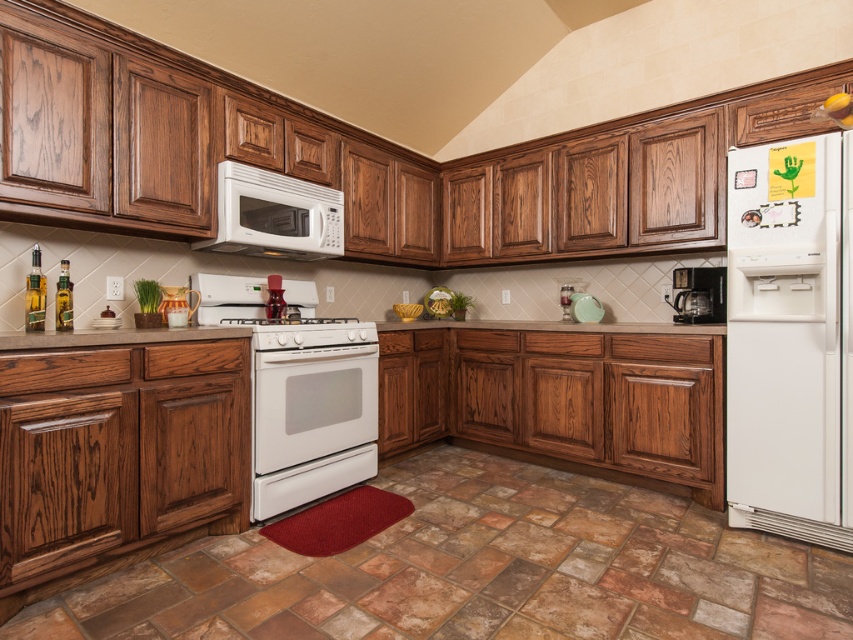
Does white glossy refrigerator at right have a greater height compared to brown wood countertop at center?

Yes, white glossy refrigerator at right is taller than brown wood countertop at center.

Does point (830, 412) come closer to viewer compared to point (45, 342)?

No.

Which is in front, point (828, 278) or point (56, 332)?

Point (56, 332)

Locate an element on the screen. This screenshot has width=853, height=640. white glossy refrigerator at right is located at coordinates (788, 342).

Can you confirm if black plastic coffee maker at right is thinner than white glossy stove at center?

Yes, black plastic coffee maker at right is thinner than white glossy stove at center.

Which of these two, black plastic coffee maker at right or white glossy stove at center, stands shorter?

With less height is white glossy stove at center.

Where is `black plastic coffee maker at right`? The width and height of the screenshot is (853, 640). black plastic coffee maker at right is located at coordinates (699, 294).

Does white glossy oven at center have a smaller size compared to white glossy stove at center?

No, white glossy oven at center is not smaller than white glossy stove at center.

Who is lower down, white glossy oven at center or white glossy stove at center?

Positioned lower is white glossy oven at center.

Is point (285, 474) farther from camera compared to point (279, 323)?

No, it is in front of (279, 323).

Identify the location of white glossy oven at center. The image size is (853, 640). (312, 416).